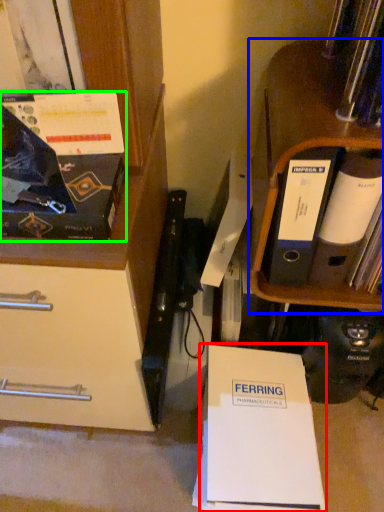
Question: Considering the real-world distances, which object is closest to paperback book (highlighted by a red box)? shelf (highlighted by a blue box) or magazine (highlighted by a green box).

Choices:
 (A) shelf
 (B) magazine

Answer: (A)